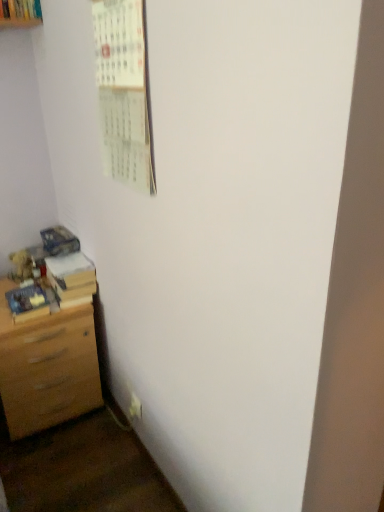
Question: From a real-world perspective, is matte blue book at lower left, positioned as the second book in back-to-front order, over light brown wood chest of drawers at lower left?

Choices:
 (A) no
 (B) yes

Answer: (B)

Question: Is matte blue book at lower left, which appears as the first book when viewed from the front, facing away from light brown wood chest of drawers at lower left?

Choices:
 (A) yes
 (B) no

Answer: (B)

Question: From a real-world perspective, does matte blue book at lower left, positioned as the second book in back-to-front order, sit lower than light brown wood chest of drawers at lower left?

Choices:
 (A) yes
 (B) no

Answer: (B)

Question: Is the position of matte blue book at lower left, which appears as the first book when viewed from the front, more distant than that of light brown wood chest of drawers at lower left?

Choices:
 (A) yes
 (B) no

Answer: (A)

Question: Is matte blue book at lower left, which appears as the first book when viewed from the front, outside of light brown wood chest of drawers at lower left?

Choices:
 (A) no
 (B) yes

Answer: (B)

Question: Would you say matte blue book at lower left, positioned as the second book in back-to-front order, contains light brown wood chest of drawers at lower left?

Choices:
 (A) yes
 (B) no

Answer: (B)

Question: Is wooden book at lower left, which is counted as the 1th book, starting from the back, positioned far away from white paper calendar at upper left?

Choices:
 (A) no
 (B) yes

Answer: (A)

Question: Is wooden book at lower left, the second book viewed from the front, aimed at white paper calendar at upper left?

Choices:
 (A) no
 (B) yes

Answer: (A)

Question: Is wooden book at lower left, the second book viewed from the front, taller than white paper calendar at upper left?

Choices:
 (A) no
 (B) yes

Answer: (A)

Question: Is wooden book at lower left, the second book viewed from the front, next to white paper calendar at upper left?

Choices:
 (A) no
 (B) yes

Answer: (A)

Question: Is wooden book at lower left, which is counted as the 1th book, starting from the back, smaller than white paper calendar at upper left?

Choices:
 (A) no
 (B) yes

Answer: (B)

Question: From the image's perspective, is wooden book at lower left, which is counted as the 1th book, starting from the back, on white paper calendar at upper left?

Choices:
 (A) yes
 (B) no

Answer: (B)

Question: From the image's perspective, is light brown wood chest of drawers at lower left located above wooden book at lower left, which is counted as the 1th book, starting from the back?

Choices:
 (A) yes
 (B) no

Answer: (B)